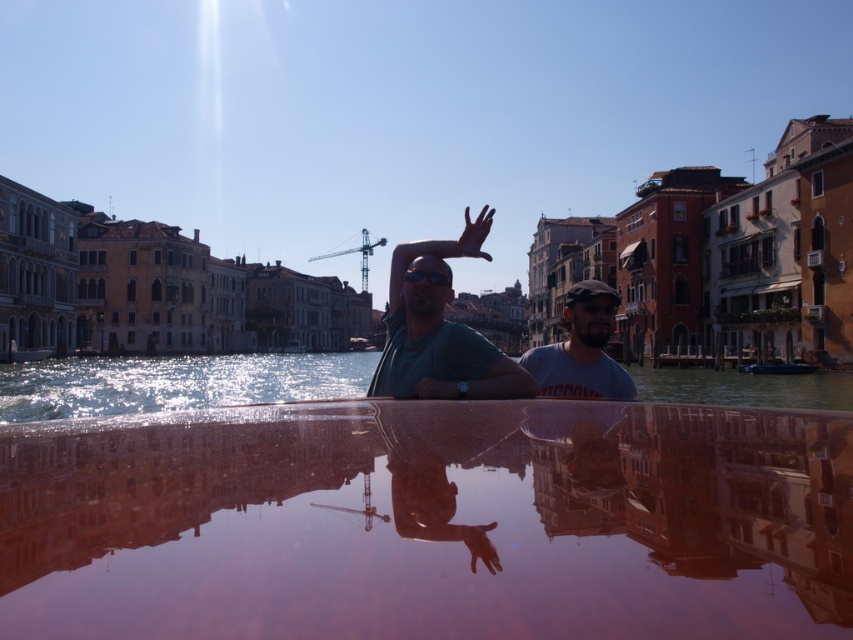
You are a tourist standing at the edge of the canal in Venice. You notice a person wearing a matte green shirt at center and black plastic goggles at center. Which object is positioned higher on the person?

The matte green shirt at center is much taller than the black plastic goggles at center, so the matte green shirt at center is positioned higher on the person.

You are a photographer trying to capture the reflection of the canal in the clear glass water at center. However, you notice the matte green shirt at center might be obstructing the view. Based on their sizes, which object should you prioritize adjusting to frame the shot better?

The clear glass water at center is smaller than the matte green shirt at center, so you should adjust the position of the matte green shirt at center first to ensure it doesn not block the smaller water area.

You are a tour guide leading a group along the canal in Venice. You notice the shiny reflective water at center and the black plastic goggles at center. If your group wants to place a small floating decoration between these two items, will there be enough space? Please provide your reasoning based on their positions.

The distance between the shiny reflective water at center and the black plastic goggles at center is 13.19 meters. Since the decoration is small, there is ample space to place it between them.